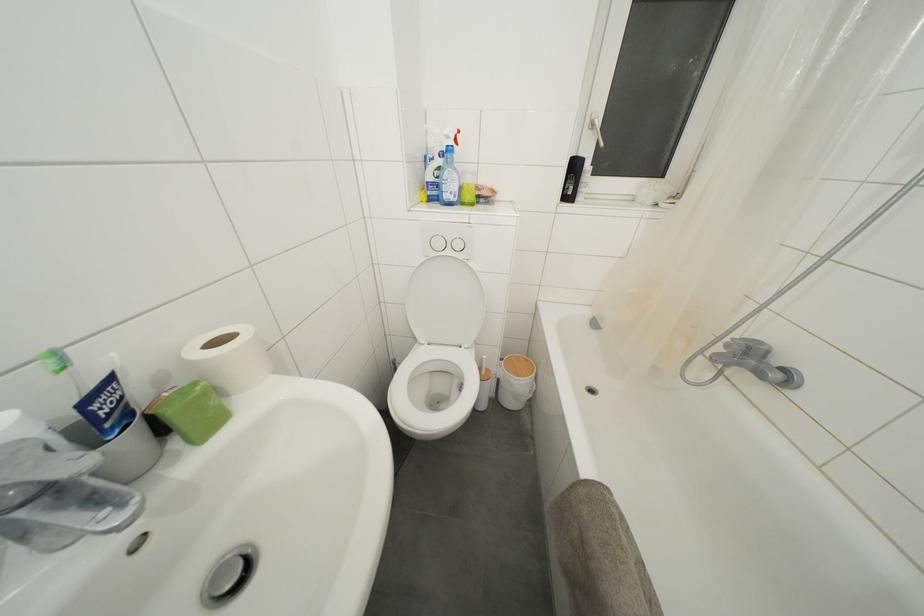
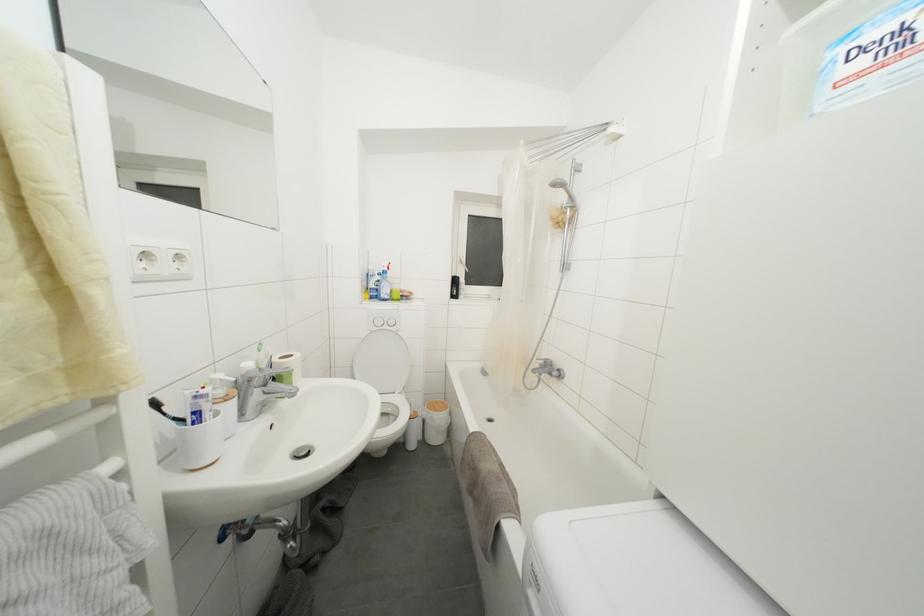
Where in the second image is the point corresponding to [438,199] from the first image?

(379, 300)